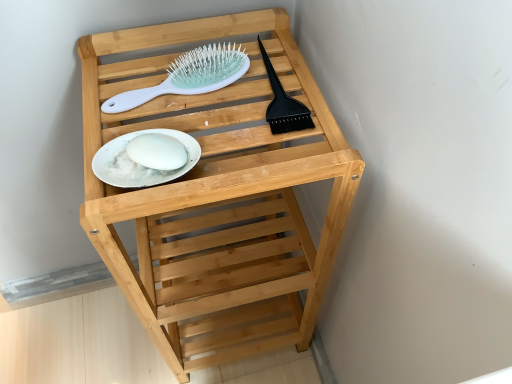
Question: Does white glossy plate at center have a smaller size compared to natural wood shelf at center?

Choices:
 (A) no
 (B) yes

Answer: (B)

Question: Does white glossy plate at center have a larger size compared to natural wood shelf at center?

Choices:
 (A) no
 (B) yes

Answer: (A)

Question: Does white glossy plate at center have a greater height compared to natural wood shelf at center?

Choices:
 (A) no
 (B) yes

Answer: (A)

Question: Is white glossy plate at center facing towards natural wood shelf at center?

Choices:
 (A) no
 (B) yes

Answer: (B)

Question: From the image's perspective, would you say white glossy plate at center is shown under natural wood shelf at center?

Choices:
 (A) yes
 (B) no

Answer: (B)

Question: Considering their positions, is white plastic hairbrush at upper center located in front of or behind white glossy plate at center?

Choices:
 (A) behind
 (B) front

Answer: (A)

Question: Would you say white plastic hairbrush at upper center is inside or outside white glossy plate at center?

Choices:
 (A) outside
 (B) inside

Answer: (A)

Question: Considering the positions of white plastic hairbrush at upper center and white glossy plate at center in the image, is white plastic hairbrush at upper center wider or thinner than white glossy plate at center?

Choices:
 (A) thin
 (B) wide

Answer: (B)

Question: Would you say white plastic hairbrush at upper center is to the left or to the right of white glossy plate at center in the picture?

Choices:
 (A) left
 (B) right

Answer: (B)

Question: From a real-world perspective, is natural wood shelf at center physically located above or below white plastic hairbrush at upper center?

Choices:
 (A) above
 (B) below

Answer: (B)

Question: From the image's perspective, is natural wood shelf at center positioned above or below white plastic hairbrush at upper center?

Choices:
 (A) above
 (B) below

Answer: (B)

Question: Is natural wood shelf at center to the left or to the right of white plastic hairbrush at upper center in the image?

Choices:
 (A) left
 (B) right

Answer: (B)

Question: In the image, is natural wood shelf at center positioned in front of or behind white plastic hairbrush at upper center?

Choices:
 (A) behind
 (B) front

Answer: (B)

Question: Does point (193, 137) appear closer or farther from the camera than point (230, 67)?

Choices:
 (A) farther
 (B) closer

Answer: (B)

Question: Considering the positions of white glossy plate at center and white plastic hairbrush at upper center in the image, is white glossy plate at center bigger or smaller than white plastic hairbrush at upper center?

Choices:
 (A) small
 (B) big

Answer: (A)